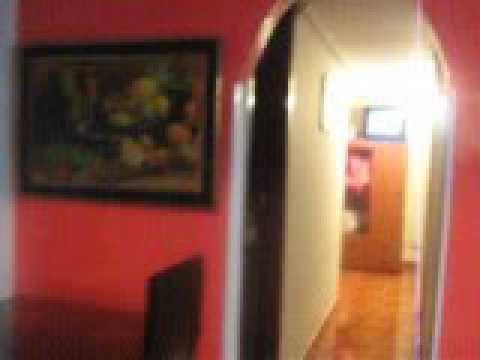
Find the location of a particular element. burgundy red walls is located at coordinates (112, 255), (52, 250), (220, 21), (456, 294).